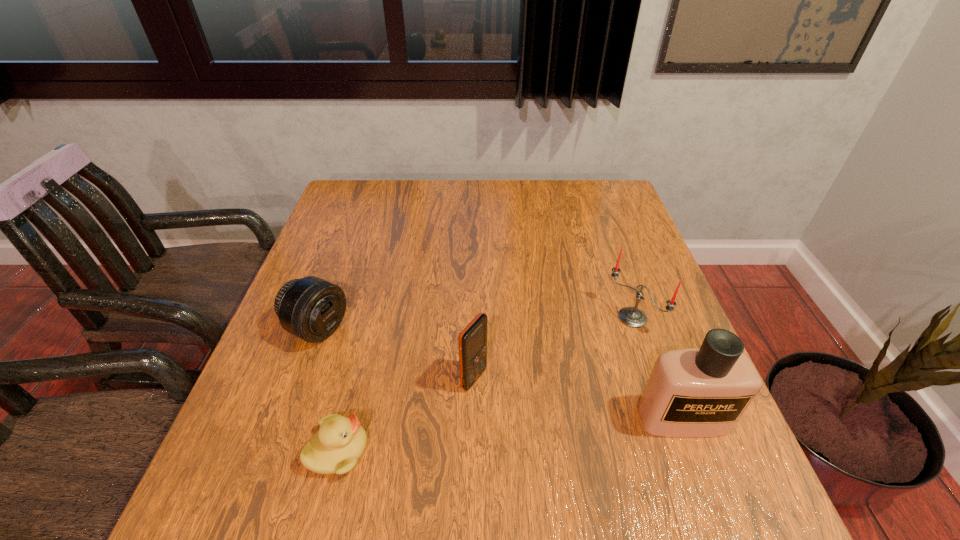
Identify the location of duckling. (335, 448).

Locate an element on the screen. The height and width of the screenshot is (540, 960). perfume is located at coordinates click(694, 392).

The height and width of the screenshot is (540, 960). I want to click on telephoto lens, so click(310, 308).

You are a GUI agent. You are given a task and a screenshot of the screen. Output one action in this format:
    pyautogui.click(x=<x>, y=<y>)
    Task: Click on the candle
    The width and height of the screenshot is (960, 540).
    Given the screenshot: What is the action you would take?
    (x=633, y=317)

Locate an element on the screen. cellular telephone is located at coordinates (472, 341).

Identify the location of the third farthest object. (472, 341).

Where is `vacant space situated on the front-facing side of the shortest object`? The image size is (960, 540). vacant space situated on the front-facing side of the shortest object is located at coordinates 484,451.

Locate an element on the screen. vacant space located 0.260m on the front-facing side of the fourth tallest object is located at coordinates (439, 390).

Find the location of `vacant region located 0.370m on the front-facing side of the fourth tallest object`. vacant region located 0.370m on the front-facing side of the fourth tallest object is located at coordinates (487, 413).

Locate an element on the screen. free spot located on the front-facing side of the fourth tallest object is located at coordinates (361, 352).